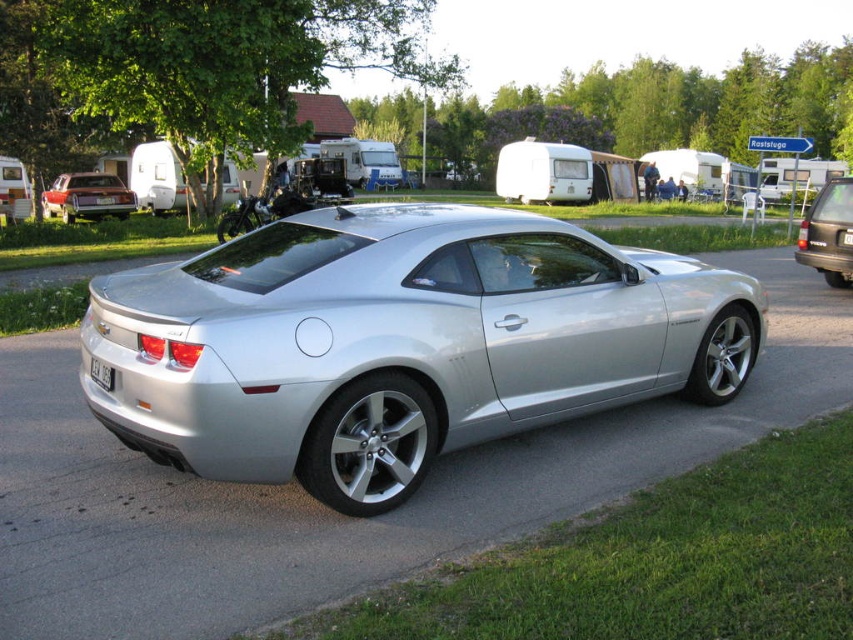
In the scene shown: Can you confirm if silver metallic sports car at center is bigger than satin black suv at right?

Indeed, silver metallic sports car at center has a larger size compared to satin black suv at right.

Does point (200, 419) lie behind point (822, 204)?

No, (200, 419) is closer to viewer.

You are a GUI agent. You are given a task and a screenshot of the screen. Output one action in this format:
    pyautogui.click(x=<x>, y=<y>)
    Task: Click on the silver metallic sports car at center
    This screenshot has width=853, height=640.
    Given the screenshot: What is the action you would take?
    pyautogui.click(x=399, y=342)

Between satin black suv at right and white plastic license plate at rear, which one appears on the right side from the viewer's perspective?

From the viewer's perspective, satin black suv at right appears more on the right side.

Is the position of satin black suv at right less distant than that of white plastic license plate at rear?

No.

Identify the location of satin black suv at right. (828, 234).

Is metallic red sedan at lower left shorter than black plastic license plate at rear?

Incorrect, metallic red sedan at lower left's height does not fall short of black plastic license plate at rear's.

Which is below, metallic red sedan at lower left or black plastic license plate at rear?

black plastic license plate at rear is lower down.

Between point (80, 195) and point (851, 241), which one is positioned in front?

Point (851, 241) is in front.

Find the location of a particular element. This screenshot has height=640, width=853. metallic red sedan at lower left is located at coordinates (86, 196).